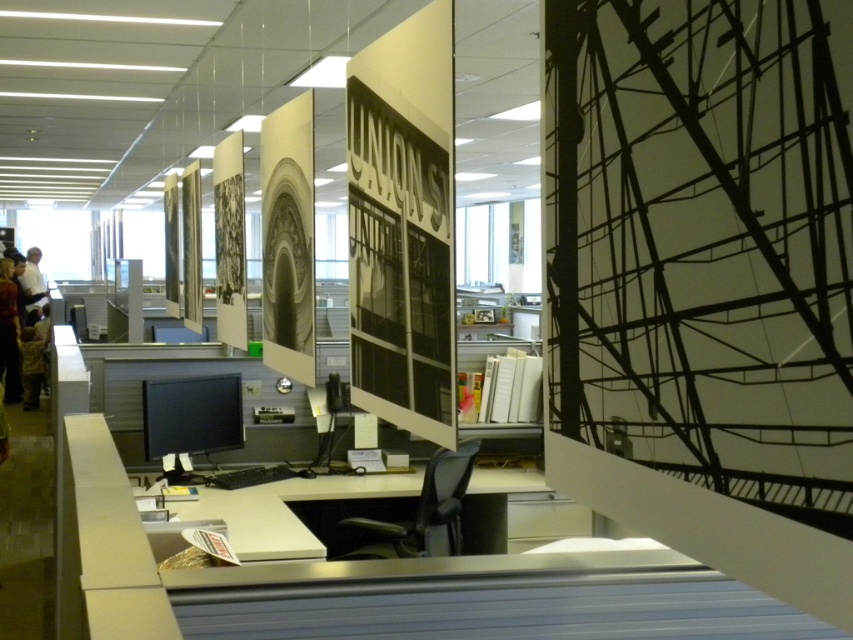
Question: Does dark brown leather jacket at lower left have a smaller size compared to white glossy pillar at center?

Choices:
 (A) no
 (B) yes

Answer: (A)

Question: Considering the real-world distances, which object is closest to the metallic silver sign at center?

Choices:
 (A) dark brown leather jacket at lower left
 (B) white shirt at left
 (C) white glossy pillar at center

Answer: (C)

Question: Is metallic silver sign at center bigger than camouflage uniform at left?

Choices:
 (A) yes
 (B) no

Answer: (B)

Question: Is camouflage uniform at left bigger than white glossy pillar at center?

Choices:
 (A) yes
 (B) no

Answer: (A)

Question: Estimate the real-world distances between objects in this image. Which object is closer to the metallic silver sign at center?

Choices:
 (A) camouflage uniform at left
 (B) white glossy pillar at center
 (C) dark brown leather jacket at lower left
 (D) white shirt at left

Answer: (B)

Question: Among these points, which one is farthest from the camera?

Choices:
 (A) tap(39, 301)
 (B) tap(387, 221)
 (C) tap(136, 298)

Answer: (A)